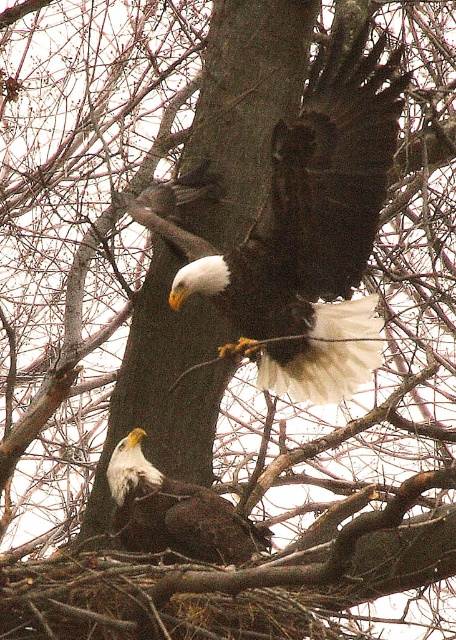
Question: Is dark brown feathers at center behind brown rough tree trunk at center?

Choices:
 (A) yes
 (B) no

Answer: (B)

Question: Which object is farther from the camera taking this photo?

Choices:
 (A) dark brown feathers at center
 (B) white-feathered bald eagle at lower left
 (C) brown rough tree trunk at center

Answer: (C)

Question: Does dark brown feathers at center appear under white-feathered bald eagle at lower left?

Choices:
 (A) yes
 (B) no

Answer: (B)

Question: Which object is the closest to the brown rough tree trunk at center?

Choices:
 (A) dark brown feathers at center
 (B) white-feathered bald eagle at lower left

Answer: (A)

Question: Which is farther from the white-feathered bald eagle at lower left?

Choices:
 (A) brown rough tree trunk at center
 (B) dark brown feathers at center

Answer: (A)

Question: Can you confirm if dark brown feathers at center is positioned to the right of brown rough tree trunk at center?

Choices:
 (A) yes
 (B) no

Answer: (A)